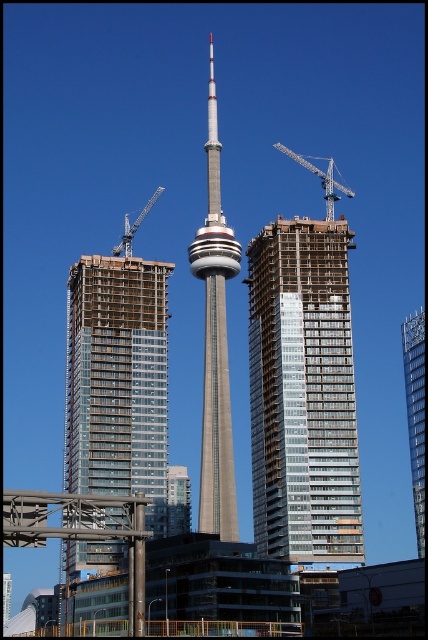
Is clear glass building at center to the left of glassy reflective skyscraper at right from the viewer's perspective?

Yes, clear glass building at center is to the left of glassy reflective skyscraper at right.

Is point (107, 330) positioned before point (416, 339)?

Yes, it is.

I want to click on clear glass building at center, so click(x=118, y=380).

Is point (418, 544) positioned before point (327, 161)?

Yes, point (418, 544) is in front of point (327, 161).

Can you confirm if glassy reflective skyscraper at right is positioned to the right of blue metallic crane at upper center?

Indeed, glassy reflective skyscraper at right is positioned on the right side of blue metallic crane at upper center.

Measure the distance between point (413, 404) and camera.

139.57 meters

Identify the location of glassy reflective skyscraper at right. The height and width of the screenshot is (640, 428). (416, 413).

Is glass/transparent building at center positioned in front of clear glass building at center?

That is True.

Image resolution: width=428 pixels, height=640 pixels. What are the coordinates of `glass/transparent building at center` in the screenshot? It's located at (303, 392).

Is point (332, 456) positioned in front of point (151, 403)?

Yes, point (332, 456) is closer to viewer.

This screenshot has height=640, width=428. Find the location of `glass/transparent building at center`. glass/transparent building at center is located at coordinates (303, 392).